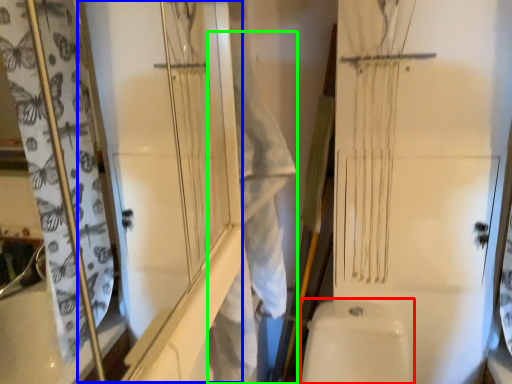
Question: Which is farther away from toilet bowl (highlighted by a red box)? screen door (highlighted by a blue box) or laundry (highlighted by a green box)?

Choices:
 (A) screen door
 (B) laundry

Answer: (A)